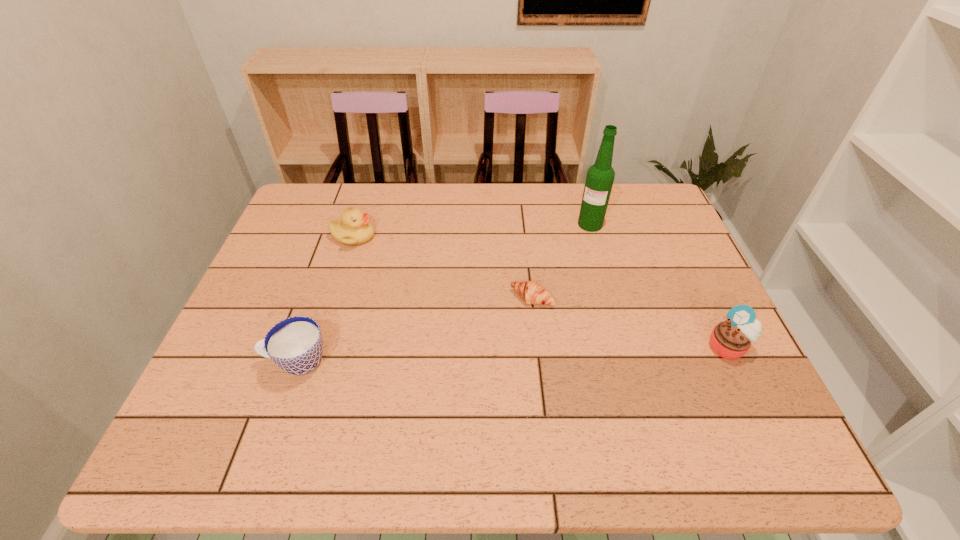
Locate an element on the screen. free region located 0.060m on the front-facing side of the fourth shortest object is located at coordinates (747, 386).

In order to click on vacant space located on the label of the beer bottle in this screenshot , I will do `click(557, 330)`.

I want to click on vacant point located 0.080m on the label of the beer bottle, so click(x=583, y=248).

Identify the location of vacant space located 0.290m on the label of the beer bottle. (566, 299).

The height and width of the screenshot is (540, 960). What are the coordinates of `free space located on the front-facing side of the third object from right to left` in the screenshot? It's located at (499, 341).

Where is `vacant space situated 0.290m on the front-facing side of the third object from right to left`? Image resolution: width=960 pixels, height=540 pixels. vacant space situated 0.290m on the front-facing side of the third object from right to left is located at coordinates (460, 396).

The width and height of the screenshot is (960, 540). In order to click on vacant area situated on the front-facing side of the third object from right to left in this screenshot , I will do `click(460, 396)`.

Where is `free point located on the beak of the duckling`? The image size is (960, 540). free point located on the beak of the duckling is located at coordinates click(x=404, y=264).

Find the location of a particular element. This screenshot has width=960, height=540. vacant region located on the beak of the duckling is located at coordinates (x=441, y=284).

Where is `vacant space situated on the beak of the duckling`? vacant space situated on the beak of the duckling is located at coordinates (470, 300).